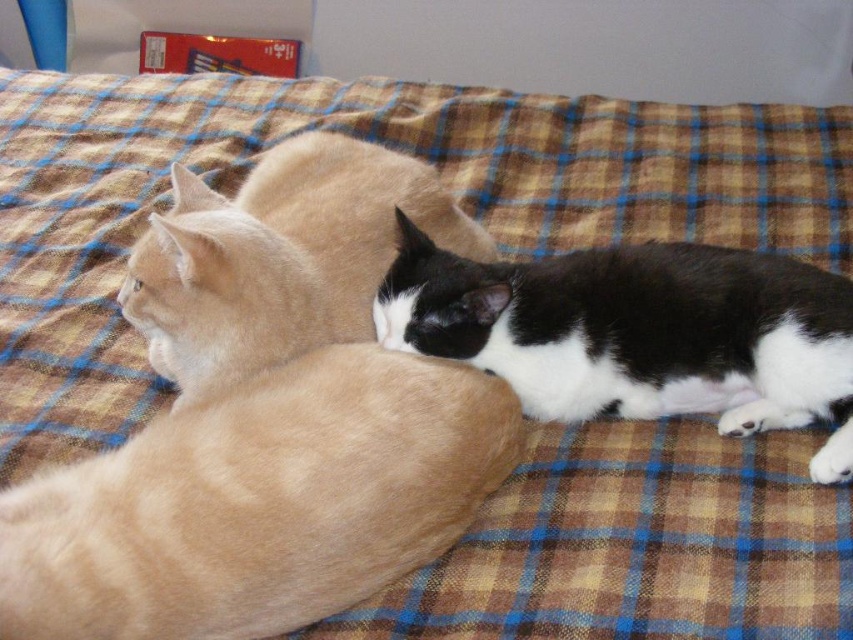
Is fluffy beige cat at center to the left of black and white fur cat at center from the viewer's perspective?

Yes, fluffy beige cat at center is to the left of black and white fur cat at center.

Between fluffy beige cat at center and black and white fur cat at center, which one appears on the right side from the viewer's perspective?

black and white fur cat at center

Is point (48, 614) positioned in front of point (573, 320)?

Yes, point (48, 614) is closer to viewer.

Locate an element on the screen. Image resolution: width=853 pixels, height=640 pixels. fluffy beige cat at center is located at coordinates (265, 419).